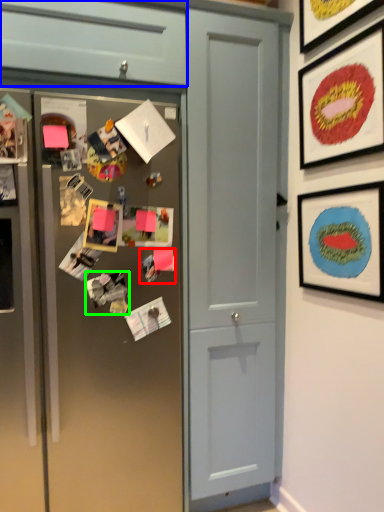
Question: Which is farther away from art (highlighted by a red box)? cabinetry (highlighted by a blue box) or art (highlighted by a green box)?

Choices:
 (A) cabinetry
 (B) art

Answer: (A)